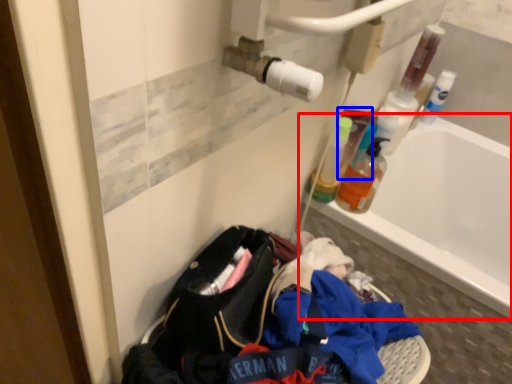
Question: Among these objects, which one is farthest to the camera, bathtub (highlighted by a red box) or mouthwash (highlighted by a blue box)?

Choices:
 (A) bathtub
 (B) mouthwash

Answer: (B)